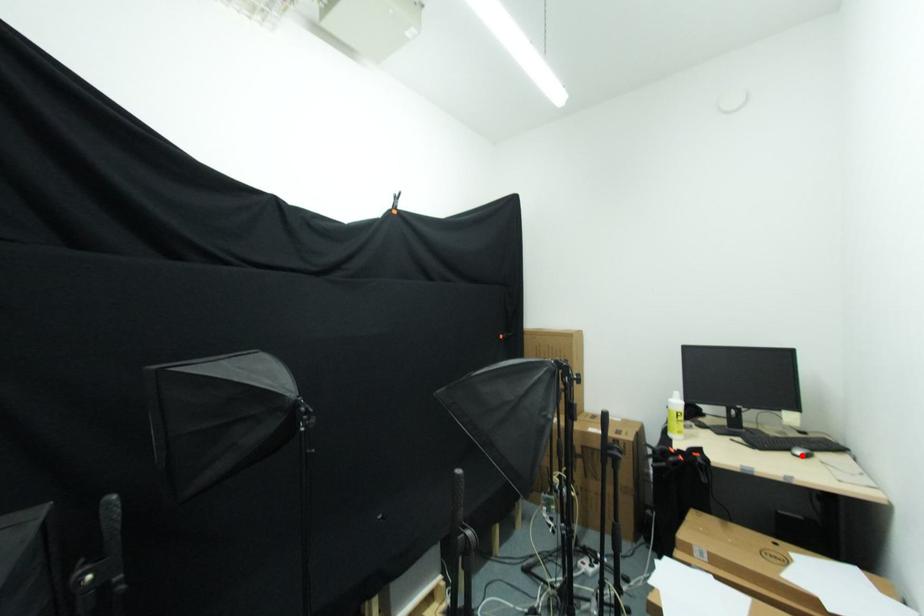
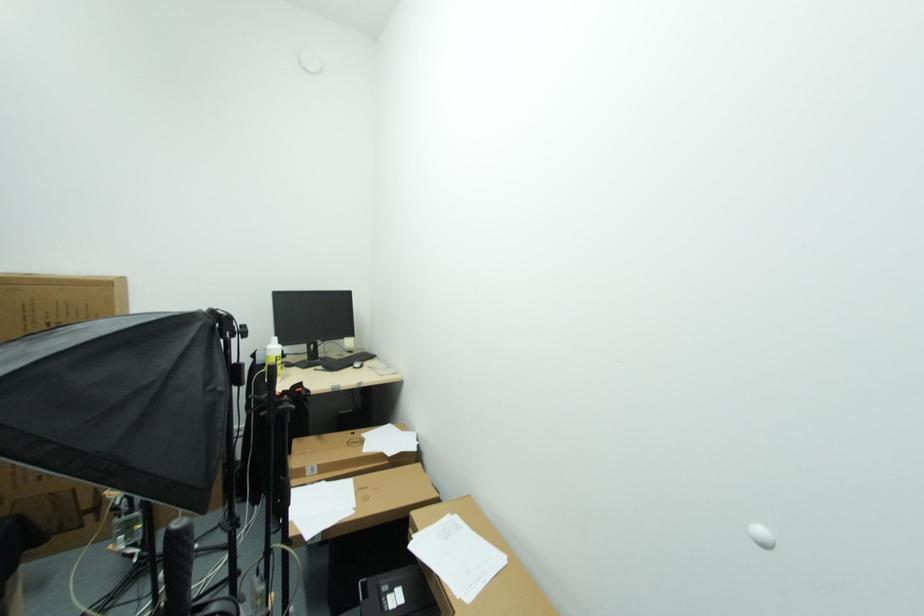
The point at the highlighted location is marked in the first image. Where is the corresponding point in the second image?

(359, 368)